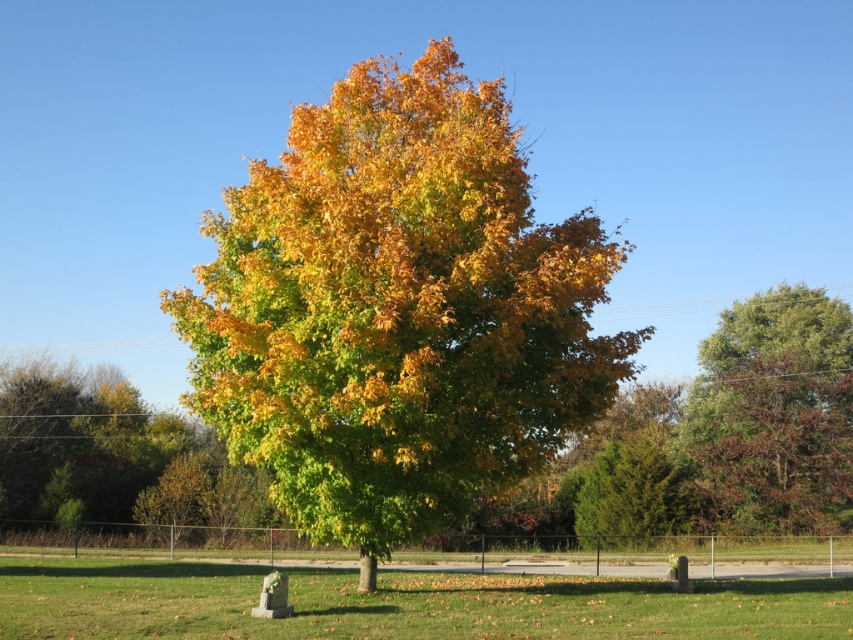
Question: Which point appears farthest from the camera in this image?

Choices:
 (A) (227, 442)
 (B) (775, 358)

Answer: (B)

Question: Does golden-green foliage at center have a smaller size compared to green leafy tree at right?

Choices:
 (A) yes
 (B) no

Answer: (B)

Question: Is golden-green foliage at center smaller than green leafy tree at right?

Choices:
 (A) no
 (B) yes

Answer: (A)

Question: Is golden-green foliage at center positioned at the back of green leafy tree at right?

Choices:
 (A) no
 (B) yes

Answer: (A)

Question: Which of the following is the farthest from the observer?

Choices:
 (A) (689, 390)
 (B) (320, 376)

Answer: (A)